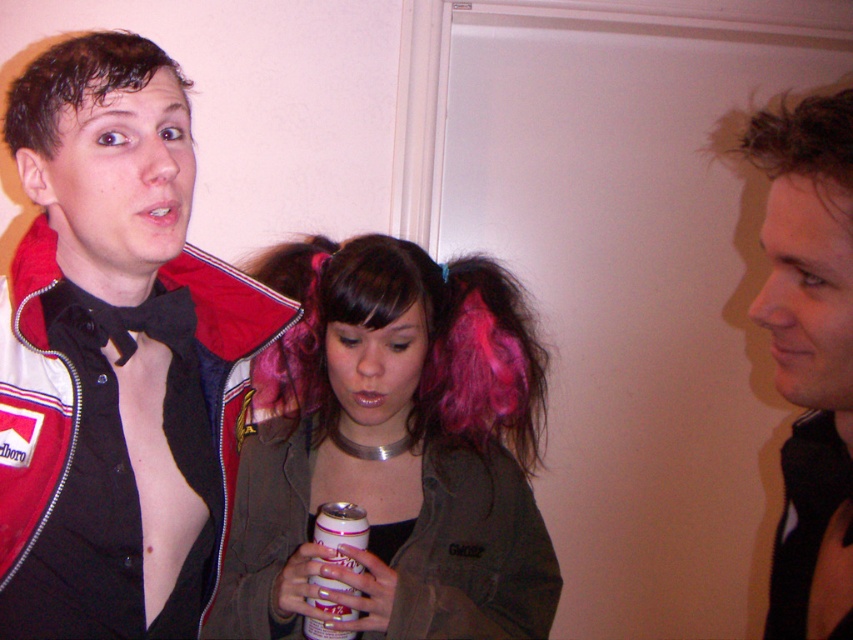
Is point (541, 573) less distant than point (320, 529)?

No.

From the picture: Is pink hair at center smaller than white plastic can at center?

No.

This screenshot has width=853, height=640. What do you see at coordinates (396, 451) in the screenshot?
I see `pink hair at center` at bounding box center [396, 451].

At what (x,y) coordinates should I click in order to perform the action: click on pink hair at center. Please return your answer as a coordinate pair (x, y). Looking at the image, I should click on (396, 451).

In the scene shown: Between shiny black bow tie at center and white plastic can at center, which one has more height?

Standing taller between the two is shiny black bow tie at center.

Is shiny black bow tie at center positioned at the back of white plastic can at center?

No, shiny black bow tie at center is in front of white plastic can at center.

Who is more distant from viewer, (112, 384) or (303, 621)?

Positioned behind is point (303, 621).

Locate an element on the screen. This screenshot has width=853, height=640. shiny black bow tie at center is located at coordinates (115, 356).

Between smooth black shirt at center and white plastic can at center, which one has more height?

With more height is smooth black shirt at center.

Is smooth black shirt at center bigger than white plastic can at center?

Correct, smooth black shirt at center is larger in size than white plastic can at center.

Is point (791, 113) more distant than point (329, 540)?

Yes, it is.

Find the location of a particular element. This screenshot has width=853, height=640. smooth black shirt at center is located at coordinates click(x=809, y=355).